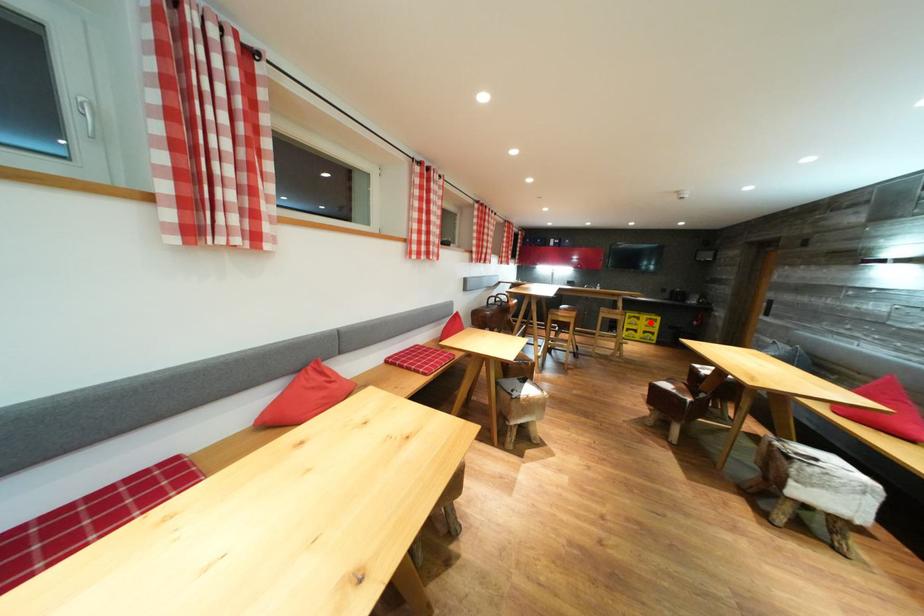
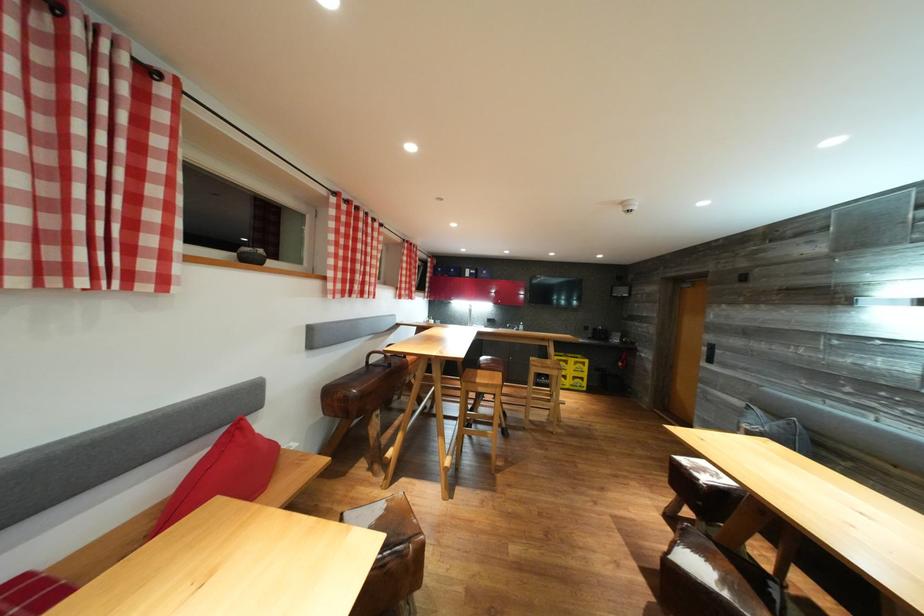
The point at the highlighted location is marked in the first image. Where is the corresponding point in the second image?

(578, 366)